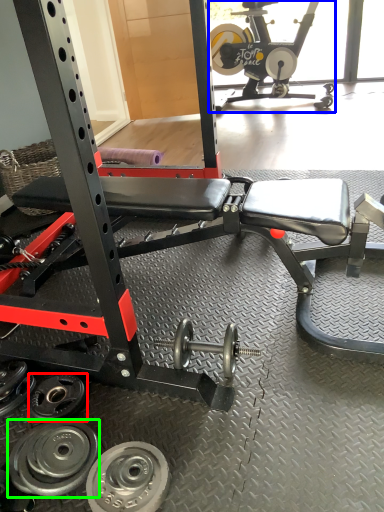
Question: Which object is the farthest from wheel (highlighted by a red box)? Choose among these: sport equipment (highlighted by a blue box) or wheel (highlighted by a green box).

Choices:
 (A) sport equipment
 (B) wheel

Answer: (A)